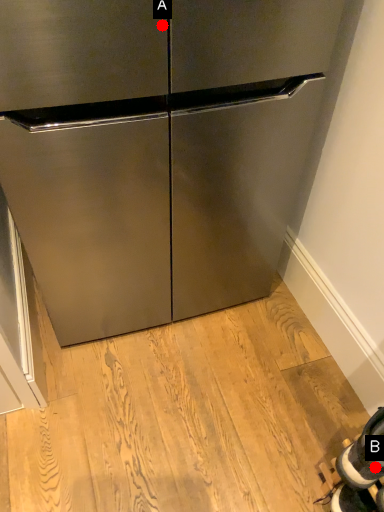
Question: Two points are circled on the image, labeled by A and B beside each circle. Which point is further to the camera?

Choices:
 (A) A is further
 (B) B is further

Answer: (B)